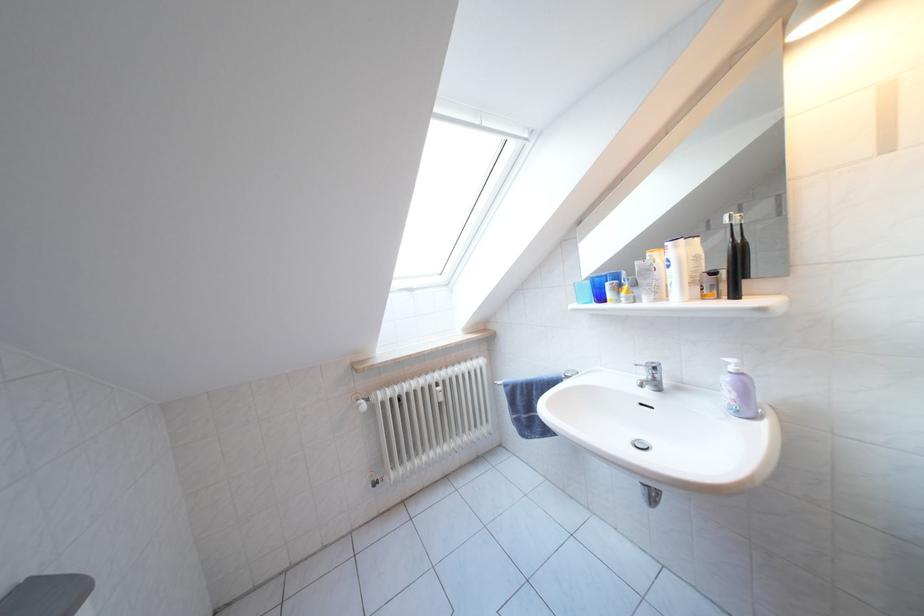
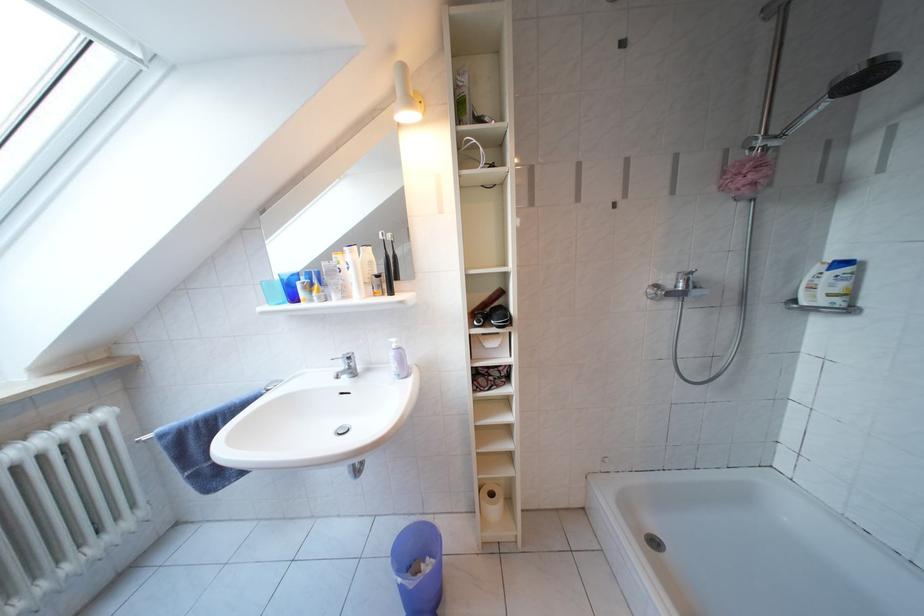
Find the pixel in the second image that matches point (489, 367) in the first image.

(110, 421)